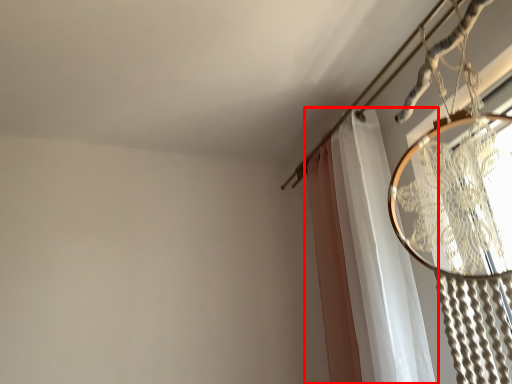
Question: From the image's perspective, where is curtain (annotated by the red box) located relative to clothesline?

Choices:
 (A) below
 (B) above

Answer: (A)